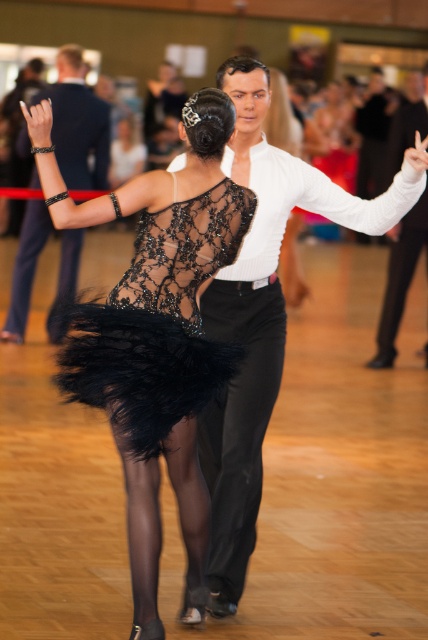
Question: Which of the following is the closest to the observer?

Choices:
 (A) lacy black dress at center
 (B) white smooth shirt at upper center

Answer: (A)

Question: Which point is closer to the camera?

Choices:
 (A) (205, 280)
 (B) (219, 554)
 (C) (211, 269)
 (D) (36, 209)

Answer: (A)

Question: Does matte black suit at upper left have a smaller size compared to white smooth shirt at upper center?

Choices:
 (A) no
 (B) yes

Answer: (B)

Question: Considering the real-world distances, which object is farthest from the matte black suit at upper left?

Choices:
 (A) lace fabric dress at center
 (B) white smooth shirt at upper center

Answer: (B)

Question: Is black lace dress at center below white smooth shirt at upper center?

Choices:
 (A) no
 (B) yes

Answer: (B)

Question: Is black lace dress at center closer to camera compared to white smooth shirt at upper center?

Choices:
 (A) no
 (B) yes

Answer: (B)